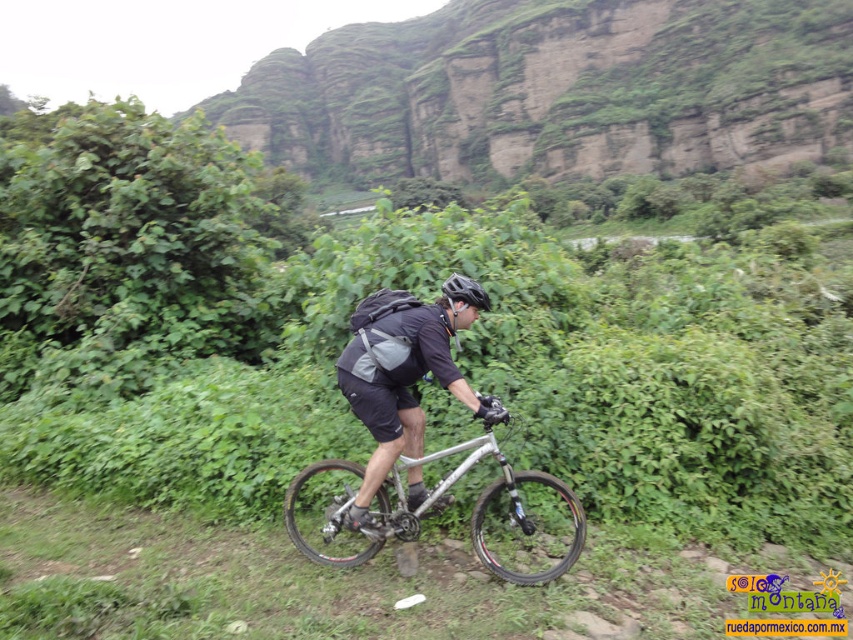
Question: Can you confirm if green leafy vegetation at center is smaller than green mossy rock at upper center?

Choices:
 (A) no
 (B) yes

Answer: (B)

Question: Which of the following is the closest to the observer?

Choices:
 (A) silver metallic bicycle at center
 (B) green leafy vegetation at center
 (C) black matte helmet at center

Answer: (A)

Question: Which point is closer to the camera?

Choices:
 (A) (460, 276)
 (B) (796, 484)

Answer: (A)

Question: Where is green mossy rock at upper center located in relation to black matte helmet at center in the image?

Choices:
 (A) right
 (B) left

Answer: (B)

Question: Among these points, which one is nearest to the camera?

Choices:
 (A) (564, 3)
 (B) (74, 134)
 (C) (496, 508)

Answer: (C)

Question: Does green leafy vegetation at center come behind green mossy rock at upper center?

Choices:
 (A) no
 (B) yes

Answer: (A)